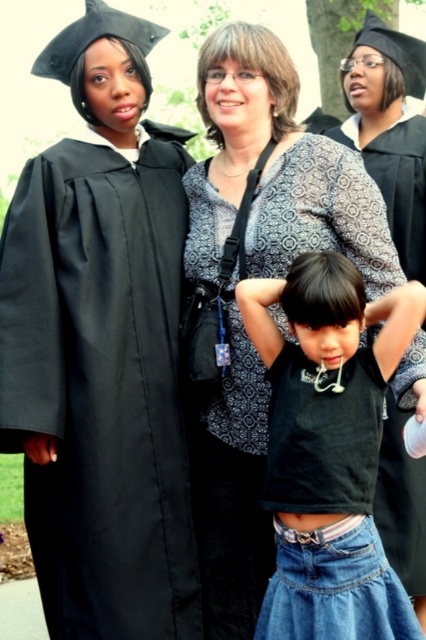
You are standing at the graduation ceremony scene. There are two points marked in the image. Which of the two points, point [57,246] or point [400,504], is closer to you?

Point [57,246] is closer to the viewer than point [400,504].

Consider the image. You are a photographer at the graduation ceremony and need to adjust the camera frame to ensure both the black matte gown at left and the black cotton shirt at center are fully visible. Given their sizes, which object requires more horizontal space in the frame?

The black matte gown at left requires more horizontal space in the frame because its width is larger than the black cotton shirt at center.